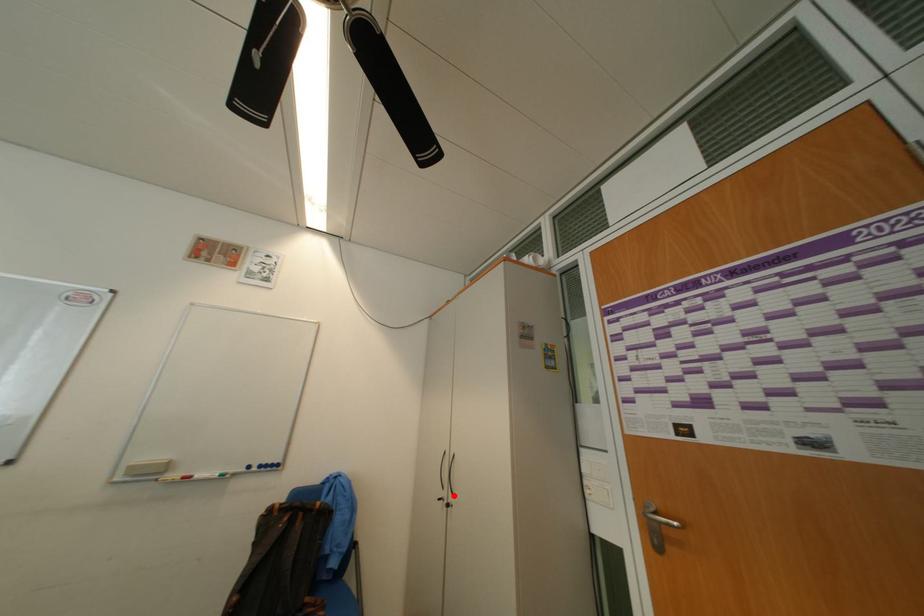
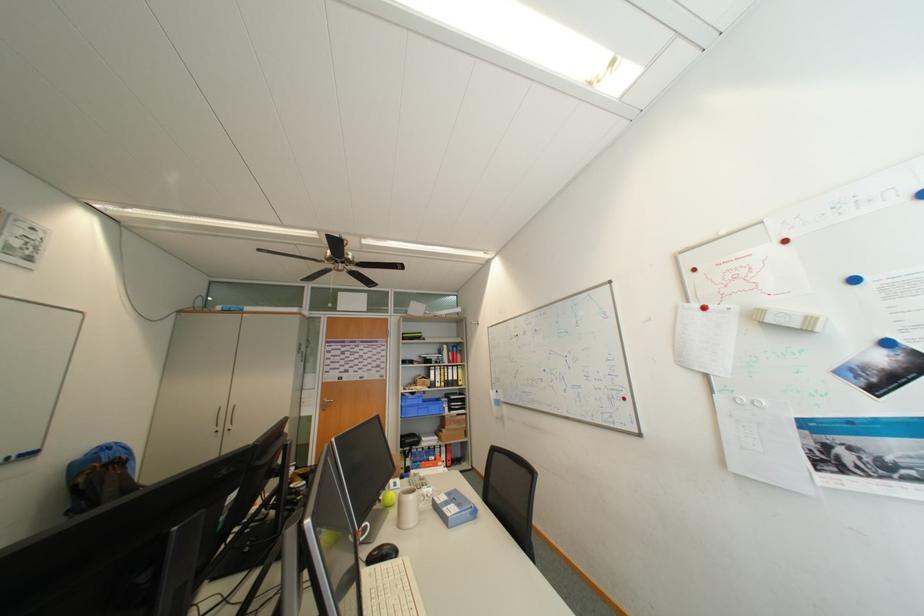
Question: I am providing you with two images of the same scene from different viewpoints. A red point is marked on the first image. Can you still see the location of the red point in image 2?

Choices:
 (A) Yes
 (B) No

Answer: (A)